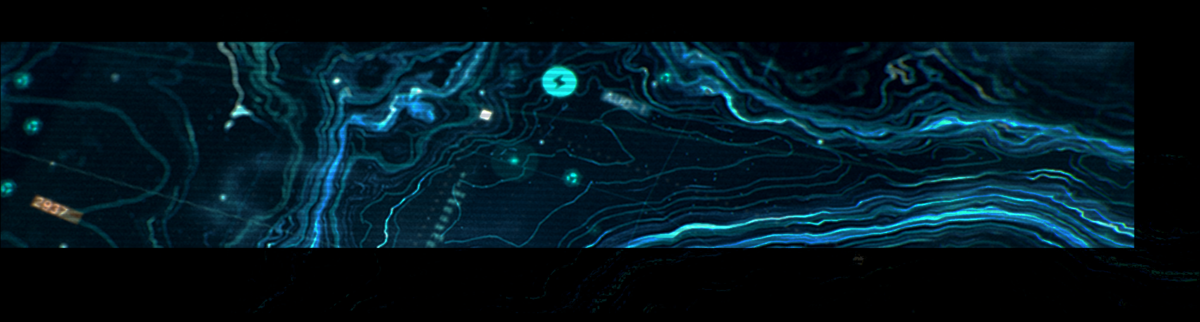
Where is `small outlet`? This screenshot has width=1200, height=322. small outlet is located at coordinates click(x=421, y=108).